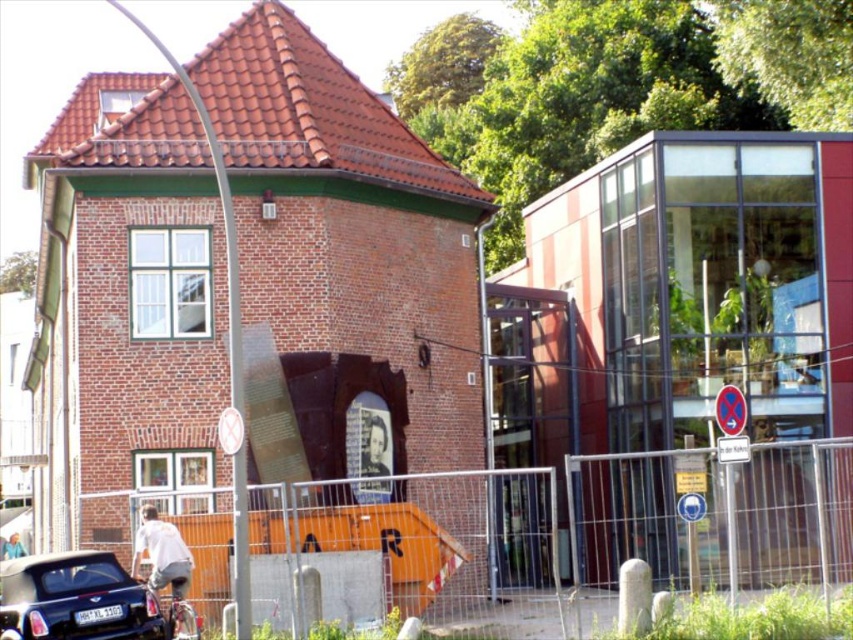
You are standing in front of the brick building with a red roof and want to walk to the shiny black car at lower left. There is a metal fence at lower left in your path. Can you walk directly to the car without going around the fence?

The metal fence at lower left is further to the viewer than the shiny black car at lower left, so the fence is closer to you. You will need to go around the metal fence at lower left to reach the shiny black car at lower left.

You are a delivery person trying to park your delivery van, which is 2 meters wide, in the space between the metal fence at lower left and the shiny black car at lower left. Can your van fit there?

The metal fence at lower left might be wider than the shiny black car at lower left, but since the exact width between them isn not specified, it is uncertain if the van can fit. Please check the actual distance before attempting to park.